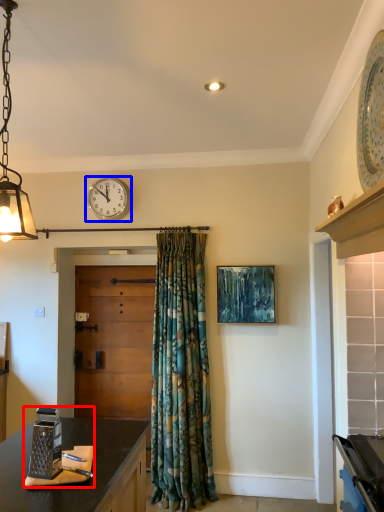
Question: Which object is further to the camera taking this photo, appliance (highlighted by a red box) or wall clock (highlighted by a blue box)?

Choices:
 (A) appliance
 (B) wall clock

Answer: (B)